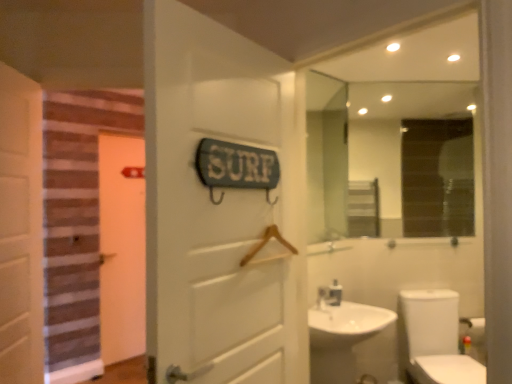
Question: Is white glossy toilet at lower right inside the boundaries of white wooden door at left, which ranks as the second door in right-to-left order, or outside?

Choices:
 (A) inside
 (B) outside

Answer: (B)

Question: Is white glossy toilet at lower right in front of or behind white wooden door at left, which ranks as the second door in right-to-left order, in the image?

Choices:
 (A) front
 (B) behind

Answer: (B)

Question: Which of these objects is positioned closest to the white glossy sink at lower right?

Choices:
 (A) white wooden door at left, which ranks as the second door in right-to-left order
 (B) white matte door at center, arranged as the 3th door when viewed from the back
 (C) orange matte door at left, the 3th door positioned from the front
 (D) clear glass mirror at upper center
 (E) white glossy toilet at lower right

Answer: (E)

Question: Considering the real-world distances, which object is farthest from the white wooden door at left, which appears as the 2th door when viewed from the front?

Choices:
 (A) white glossy sink at lower right
 (B) orange matte door at left, the first door viewed from the left
 (C) white glossy toilet at lower right
 (D) clear glass mirror at upper center
 (E) white matte door at center, the first door in the right-to-left sequence

Answer: (D)